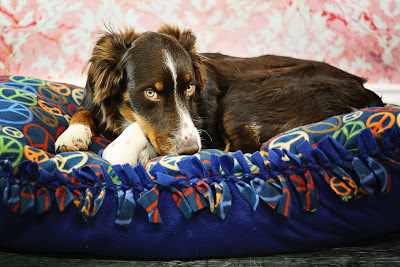
Find the location of `printed pink and white wallpaper in the background`. printed pink and white wallpaper in the background is located at coordinates (266, 39).